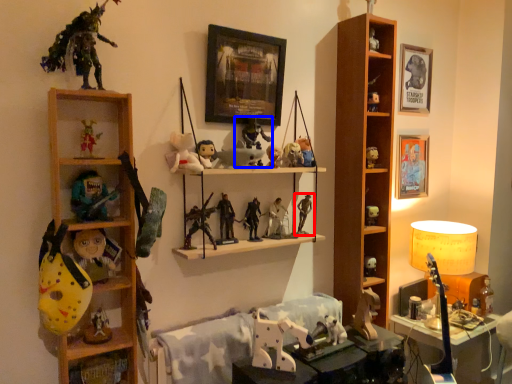
Question: Which object is further to the camera taking this photo, toy (highlighted by a red box) or toy (highlighted by a blue box)?

Choices:
 (A) toy
 (B) toy

Answer: (A)